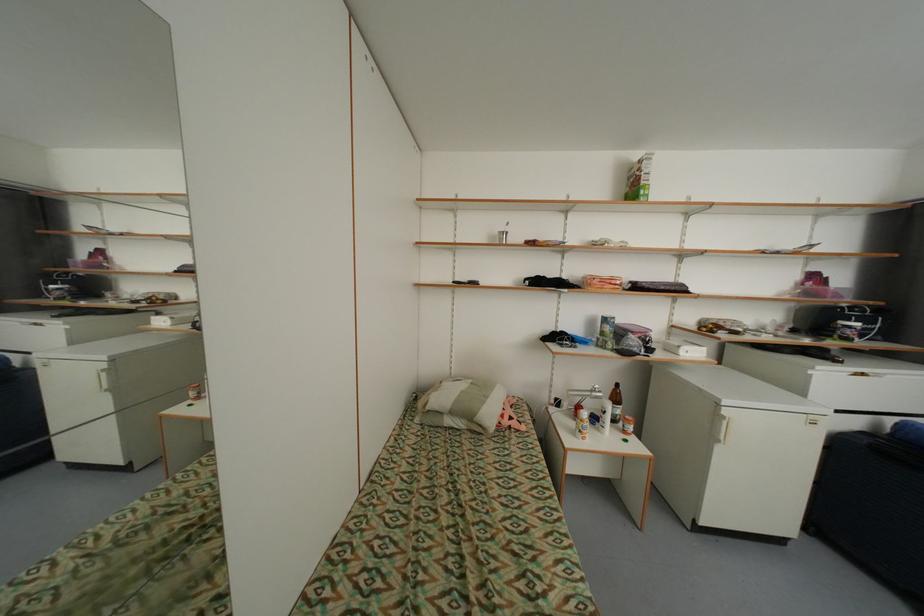
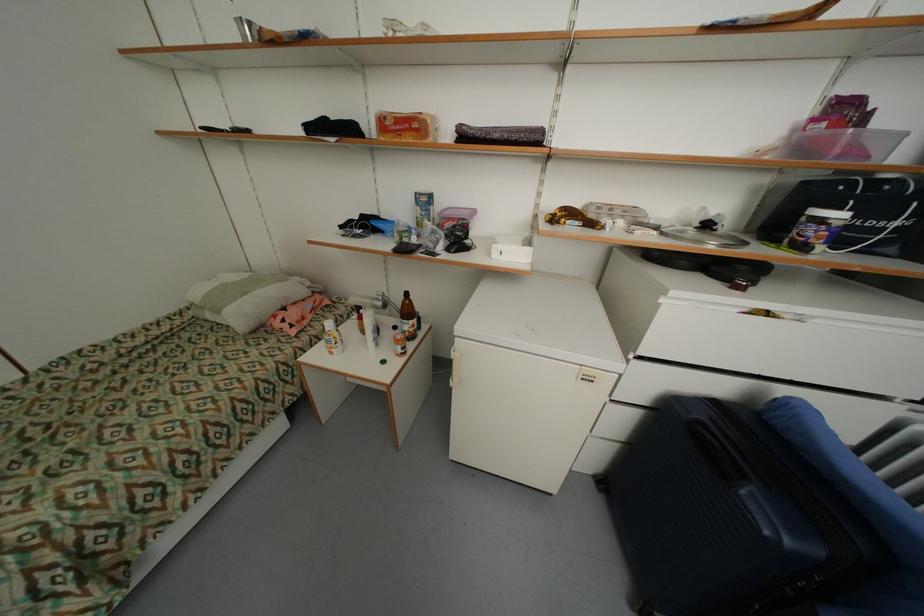
Where in the second image is the point corresponding to [621,284] from the first image?

(421, 126)